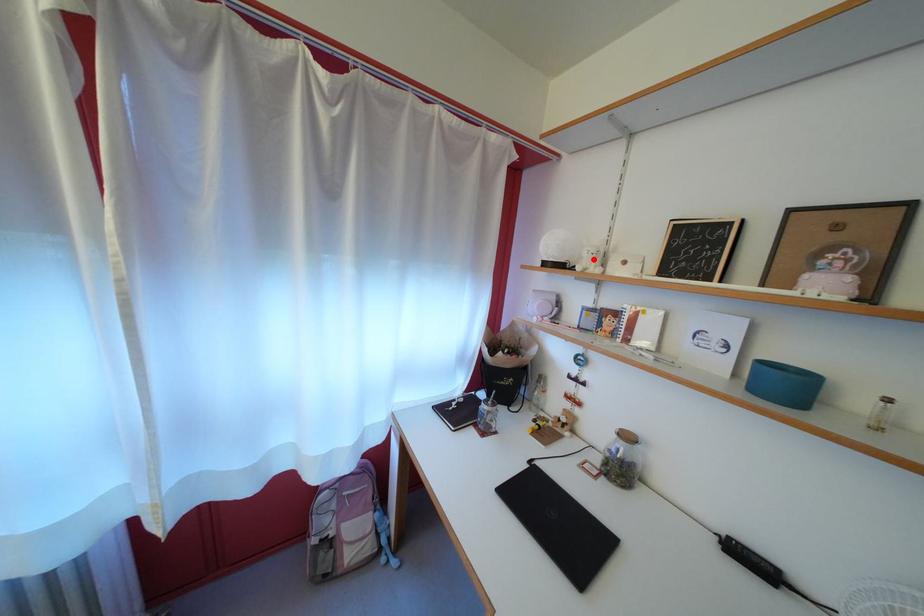
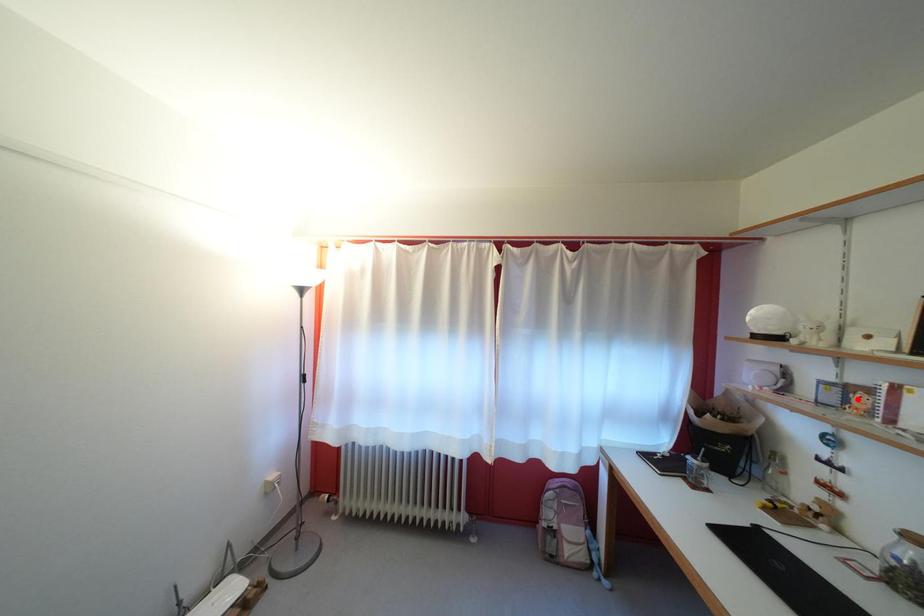
I am providing you with two images of the same scene from different viewpoints. A red point is marked on the first image and another point is marked on the second image. Does the point marked in image1 correspond to the same location as the one in image2?

No